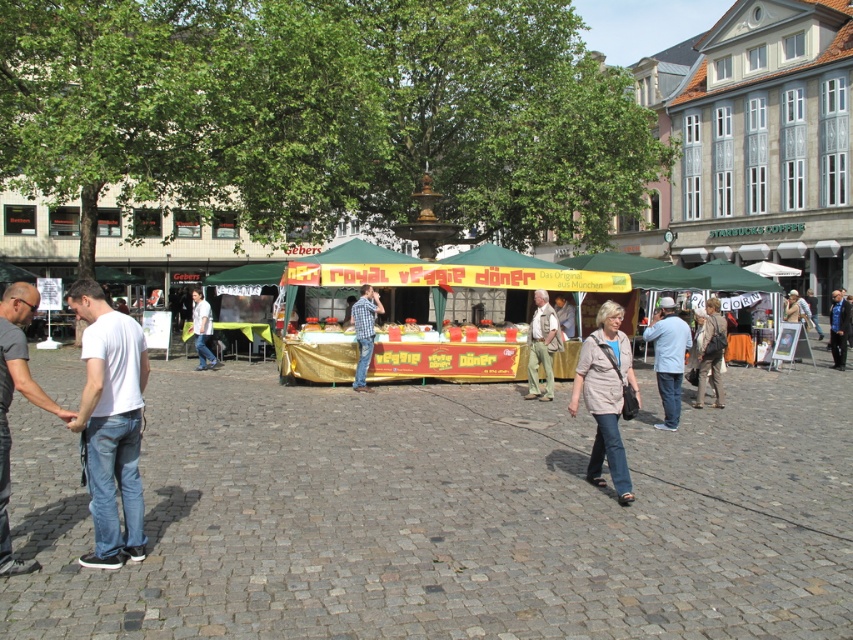
Question: Is the position of matte brown jacket at center less distant than that of blue plaid shirt at center?

Choices:
 (A) yes
 (B) no

Answer: (A)

Question: From the image, what is the correct spatial relationship of light brown leather jacket at center in relation to matte brown jacket at center?

Choices:
 (A) left
 (B) right

Answer: (A)

Question: Which point is closer to the camera?

Choices:
 (A) (206, 326)
 (B) (700, 372)
 (C) (364, 301)

Answer: (B)

Question: Which of the following is the farthest from the observer?

Choices:
 (A) (367, 360)
 (B) (3, 461)
 (C) (698, 355)
 (D) (544, 308)

Answer: (A)

Question: Which point is farther from the camera taking this photo?

Choices:
 (A) (x=614, y=340)
 (B) (x=352, y=308)

Answer: (B)

Question: Is light blue denim jeans at center closer to camera compared to white shirt at center?

Choices:
 (A) no
 (B) yes

Answer: (B)